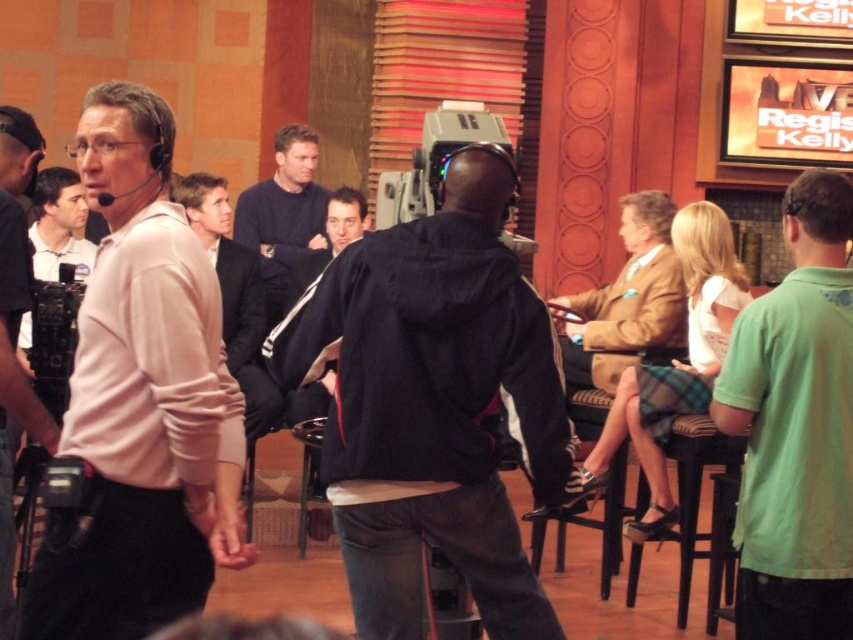
You are a camera operator adjusting your position in the studio. You need to ensure both the black fabric jacket at center and the matte pink shirt at left are visible in your shot. Based on their positions, which direction should you pan your camera to include both subjects?

The black fabric jacket at center is to the right of the matte pink shirt at left. To include both subjects, you should pan your camera from the left towards the right, starting with the matte pink shirt at left and moving to the black fabric jacket at center.

You are a costume designer reviewing the studio setup. You notice the black fabric jacket at center and the dark blue suit at center. Which one appears to be smaller in size?

The black fabric jacket at center is smaller in size compared to the dark blue suit at center.

You are a camera operator adjusting your position in the studio. You notice the black fabric jacket at center and the matte pink shirt at left. Which of these two crew members is blocking your view of the other?

The black fabric jacket at center is blocking the view of the matte pink shirt at left because it is positioned in front of it.